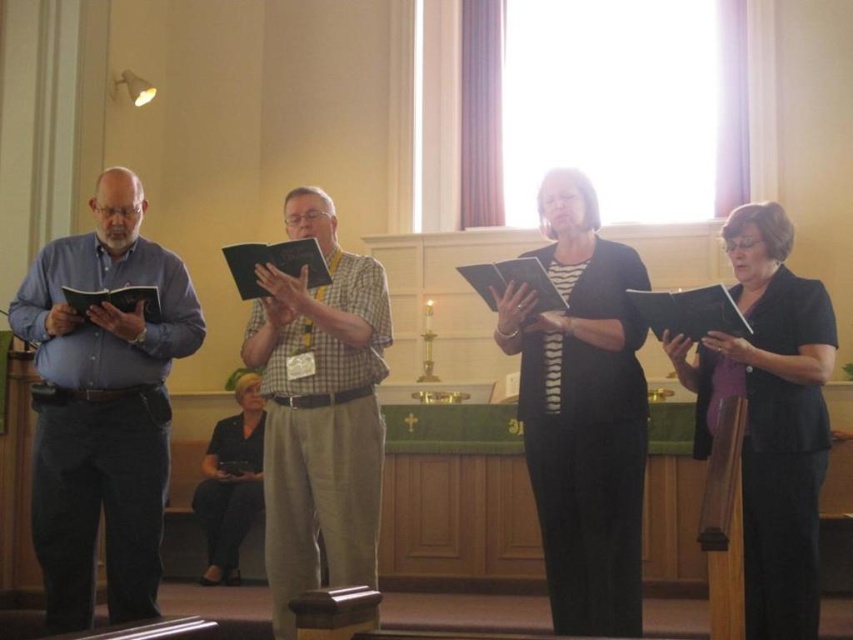
Consider the image. You are a photographer standing in front of the group. You need to capture a photo of the blue shirt at left and the checkered fabric shirt at center. The camera you are using has a minimum focusing distance of 30 inches. Can you take a clear photo of both subjects without moving the camera?

The distance between the blue shirt at left and the checkered fabric shirt at center is 36.24 inches, which is greater than the camera minimum focusing distance of 30 inches. Therefore, you can take a clear photo of both subjects without moving the camera.

From the picture: You are a photographer setting up for a group photo. You need to ensure that the black matte dress at center and the black fabric book at lower left are both visible in the final shot. Based on their positions, which object is closer to the camera?

The black matte dress at center is closer to the camera because it is in front of the black fabric book at lower left.